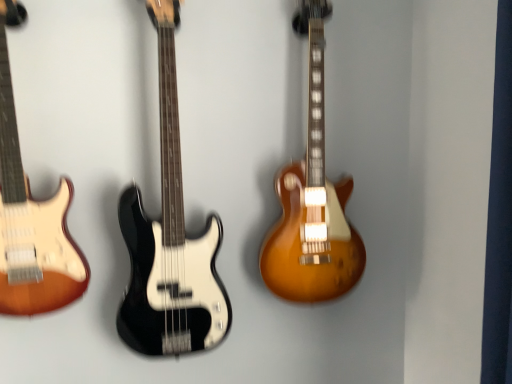
Question: From a real-world perspective, is black glossy bass guitar at center, positioned as the 2th guitar in right-to-left order, located beneath satin sunburst electric guitar at center, the third guitar when ordered from left to right?

Choices:
 (A) yes
 (B) no

Answer: (A)

Question: Is satin sunburst electric guitar at center, which ranks as the 1th guitar in right-to-left order, located within black glossy bass guitar at center, positioned as the 2th guitar in right-to-left order?

Choices:
 (A) no
 (B) yes

Answer: (A)

Question: From a real-world perspective, is black glossy bass guitar at center, positioned as the 2th guitar in right-to-left order, positioned over satin sunburst electric guitar at center, the third guitar when ordered from left to right, based on gravity?

Choices:
 (A) yes
 (B) no

Answer: (B)

Question: From the image's perspective, does black glossy bass guitar at center, which is the second guitar in left-to-right order, appear lower than satin sunburst electric guitar at center, the third guitar when ordered from left to right?

Choices:
 (A) yes
 (B) no

Answer: (A)

Question: Does black glossy bass guitar at center, which is the second guitar in left-to-right order, have a lesser height compared to satin sunburst electric guitar at center, the third guitar when ordered from left to right?

Choices:
 (A) yes
 (B) no

Answer: (B)

Question: Is black glossy bass guitar at center, positioned as the 2th guitar in right-to-left order, at the right side of satin sunburst electric guitar at center, which ranks as the 1th guitar in right-to-left order?

Choices:
 (A) no
 (B) yes

Answer: (A)

Question: Could you tell me if satin sunburst electric guitar at center, which ranks as the 1th guitar in right-to-left order, is facing black glossy bass guitar at center, which is the second guitar in left-to-right order?

Choices:
 (A) no
 (B) yes

Answer: (A)

Question: Is satin sunburst electric guitar at center, which ranks as the 1th guitar in right-to-left order, positioned far away from black glossy bass guitar at center, which is the second guitar in left-to-right order?

Choices:
 (A) yes
 (B) no

Answer: (B)

Question: Can you confirm if satin sunburst electric guitar at center, the third guitar when ordered from left to right, is thinner than black glossy bass guitar at center, positioned as the 2th guitar in right-to-left order?

Choices:
 (A) no
 (B) yes

Answer: (B)

Question: From the image's perspective, does satin sunburst electric guitar at center, which ranks as the 1th guitar in right-to-left order, appear higher than black glossy bass guitar at center, which is the second guitar in left-to-right order?

Choices:
 (A) yes
 (B) no

Answer: (A)

Question: From a real-world perspective, is satin sunburst electric guitar at center, which ranks as the 1th guitar in right-to-left order, over black glossy bass guitar at center, positioned as the 2th guitar in right-to-left order?

Choices:
 (A) no
 (B) yes

Answer: (B)

Question: From a real-world perspective, does satin sunburst electric guitar at center, the third guitar when ordered from left to right, sit lower than black glossy bass guitar at center, which is the second guitar in left-to-right order?

Choices:
 (A) yes
 (B) no

Answer: (B)

Question: Considering the relative positions of satin sunburst electric guitar at center, the third guitar when ordered from left to right, and sunburst wood electric guitar at left, acting as the 3th guitar starting from the right, in the image provided, is satin sunburst electric guitar at center, the third guitar when ordered from left to right, behind sunburst wood electric guitar at left, acting as the 3th guitar starting from the right,?

Choices:
 (A) no
 (B) yes

Answer: (B)